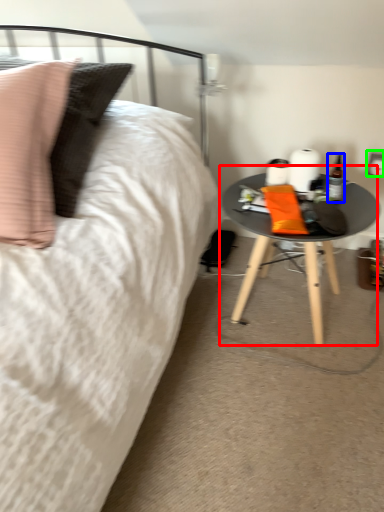
Question: Considering the real-world distances, which object is closest to table (highlighted by a red box)? bottle (highlighted by a blue box) or electric outlet (highlighted by a green box).

Choices:
 (A) bottle
 (B) electric outlet

Answer: (A)